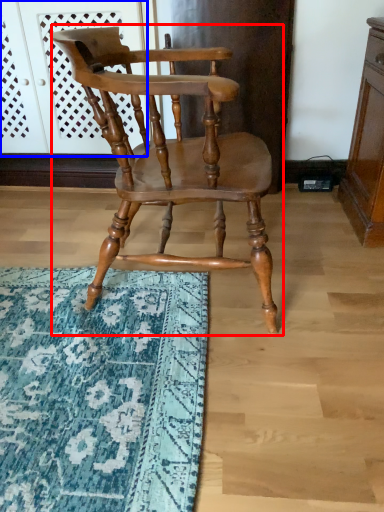
Question: Which of the following is the farthest to the observer, chair (highlighted by a red box) or screen door (highlighted by a blue box)?

Choices:
 (A) chair
 (B) screen door

Answer: (B)